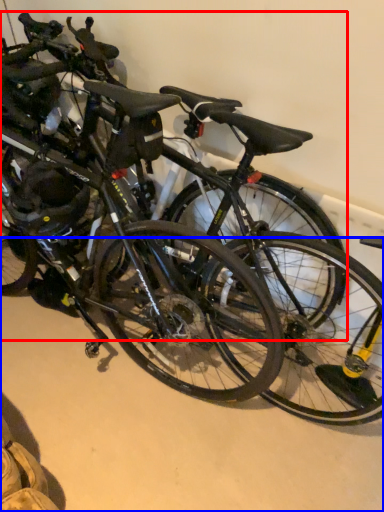
Question: Which point is closer to the camera, bicycle (highlighted by a red box) or concrete (highlighted by a blue box)?

Choices:
 (A) bicycle
 (B) concrete

Answer: (A)